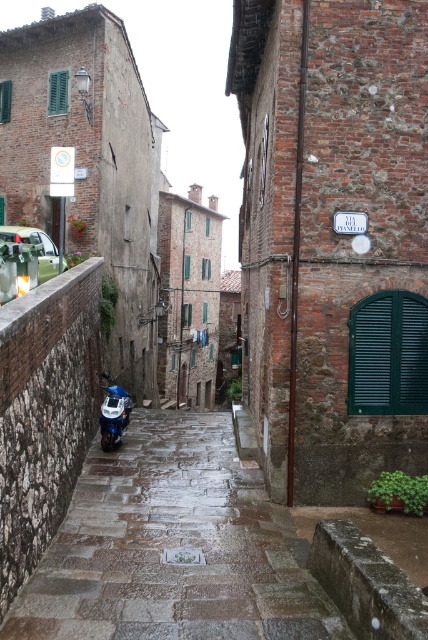
Question: Is blue metallic motorcycle at lower left further to camera compared to metallic silver car at left?

Choices:
 (A) no
 (B) yes

Answer: (A)

Question: Which point appears farthest from the camera in this image?

Choices:
 (A) (29, 227)
 (B) (116, 422)

Answer: (A)

Question: Is rustic stone alley at center smaller than blue metallic motorcycle at lower left?

Choices:
 (A) yes
 (B) no

Answer: (B)

Question: Which object is farther from the camera taking this photo?

Choices:
 (A) rustic stone alley at center
 (B) blue metallic motorcycle at lower left

Answer: (B)

Question: Is blue metallic motorcycle at lower left thinner than metallic silver car at left?

Choices:
 (A) no
 (B) yes

Answer: (B)

Question: Estimate the real-world distances between objects in this image. Which object is closer to the metallic silver car at left?

Choices:
 (A) rustic stone alley at center
 (B) blue metallic motorcycle at lower left

Answer: (B)